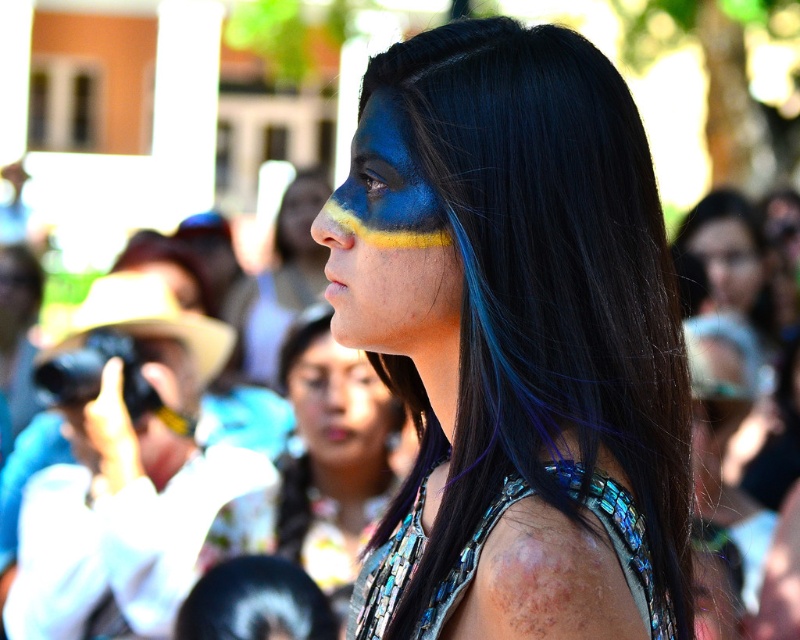
You are an artist trying to replicate the outfit of the person in the image. You need to know which of the two blue elements, the blue metallic hair at center or the matte blue face at center, requires more material due to its size. Which one should you prepare more material for?

The blue metallic hair at center has a larger size compared to the matte blue face at center, so you should prepare more material for the blue metallic hair at center.

You are a photographer holding a camera. You want to capture a closeup shot of the blue metallic hair at center. What is the minimum distance you need to be from the hair to get the best closeup?

The minimum distance you need to be from the blue metallic hair at center is 1.30 meters to get the best closeup, as the camera and blue metallic hair at center are 1.30 meters apart from each other.